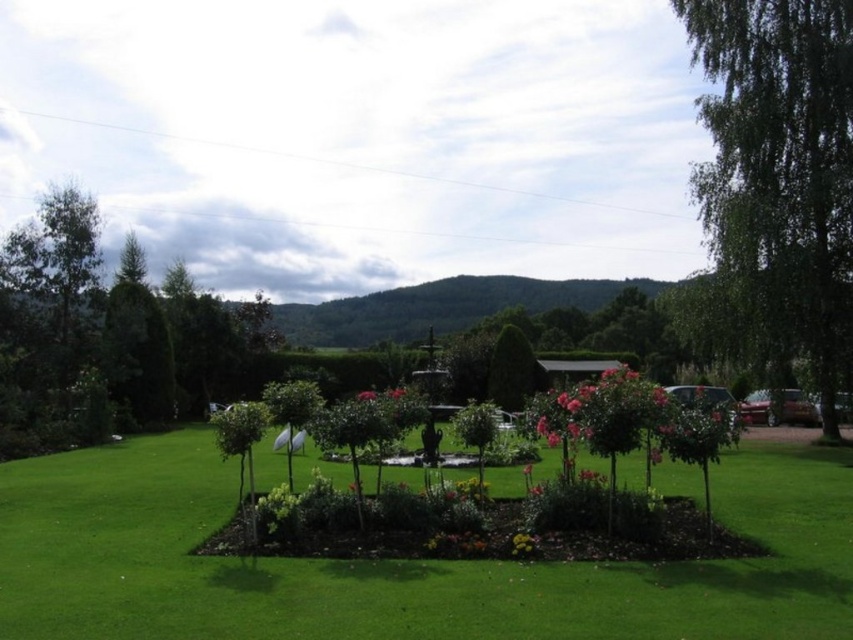
Based on the photo, between green lawn at center and pink matte flowers at center, which one appears on the right side from the viewer's perspective?

pink matte flowers at center

Can you confirm if green lawn at center is positioned below pink matte flowers at center?

Indeed, green lawn at center is positioned under pink matte flowers at center.

Is point (821, 554) more distant than point (607, 406)?

No, (821, 554) is closer to viewer.

Locate an element on the screen. green lawn at center is located at coordinates (397, 563).

Between green leafy tree at right and pink matte flower at center, which one is positioned lower?

pink matte flower at center

Can you confirm if green leafy tree at right is taller than pink matte flower at center?

Yes.

Does point (722, 252) lie in front of point (368, 397)?

That is False.

What are the coordinates of `green leafy tree at right` in the screenshot? It's located at (780, 173).

Does point (619, 394) lie in front of point (363, 392)?

Yes, it is in front of point (363, 392).

Where is `pink matte flowers at center`? pink matte flowers at center is located at coordinates (602, 412).

Where is `pink matte flowers at center`? This screenshot has width=853, height=640. pink matte flowers at center is located at coordinates (602, 412).

I want to click on pink matte flowers at center, so click(602, 412).